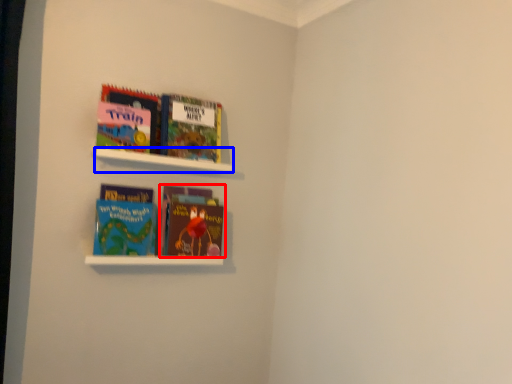
Question: Among these objects, which one is farthest to the camera, book (highlighted by a red box) or cabinet (highlighted by a blue box)?

Choices:
 (A) book
 (B) cabinet

Answer: (A)